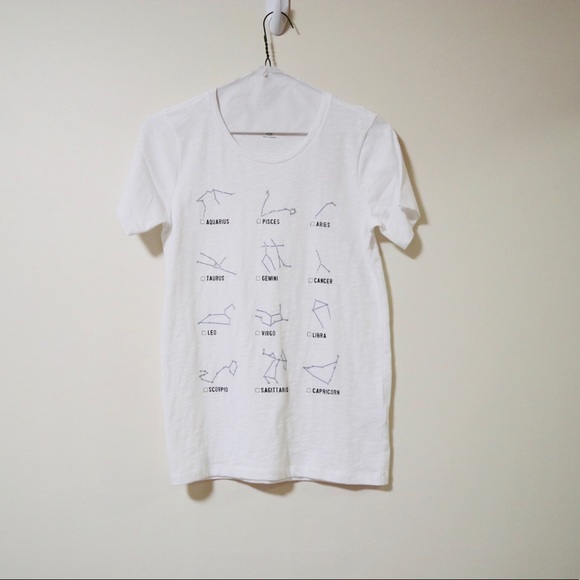
Locate an element on the screen. The width and height of the screenshot is (580, 580). hook on hanger is located at coordinates (287, 14), (264, 42).